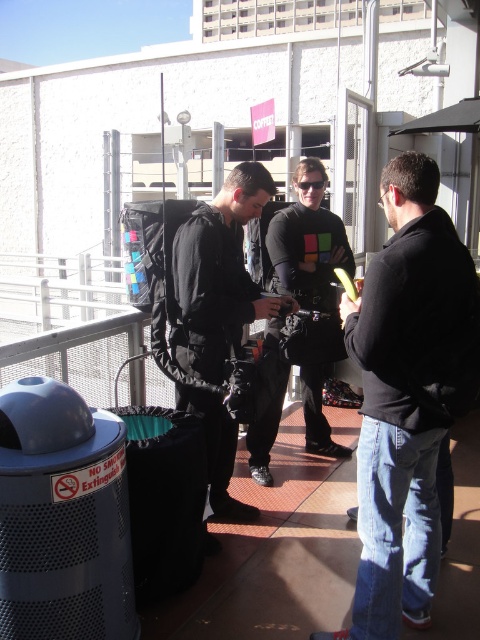
You are a fashion designer observing the scene. You need to decide which piece of clothing would be better suited for a shorter person. Based on the black matte jacket at right and the black matte shirt at center, which one should you recommend?

The black matte jacket at right has a lesser height compared to black matte shirt at center, so it would be better suited for a shorter person.

You are a photographer trying to capture a photo of the black matte jacket at center from a specific angle. If you position your camera at the origin point of the coordinate system, what are the coordinates where you should aim to ensure the jacket is centered in the frame?

The coordinates where you should aim to center the black matte jacket at center are at point (218,276), as this is the 2D location of the jacket.